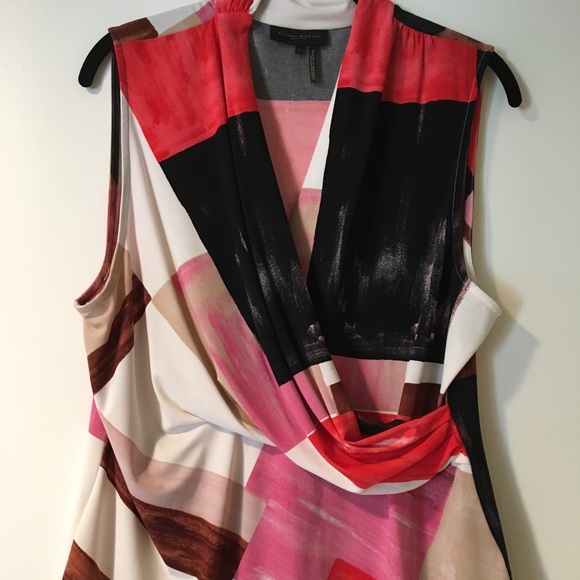
Find the location of a particular element. The width and height of the screenshot is (580, 580). wall is located at coordinates (531, 194).